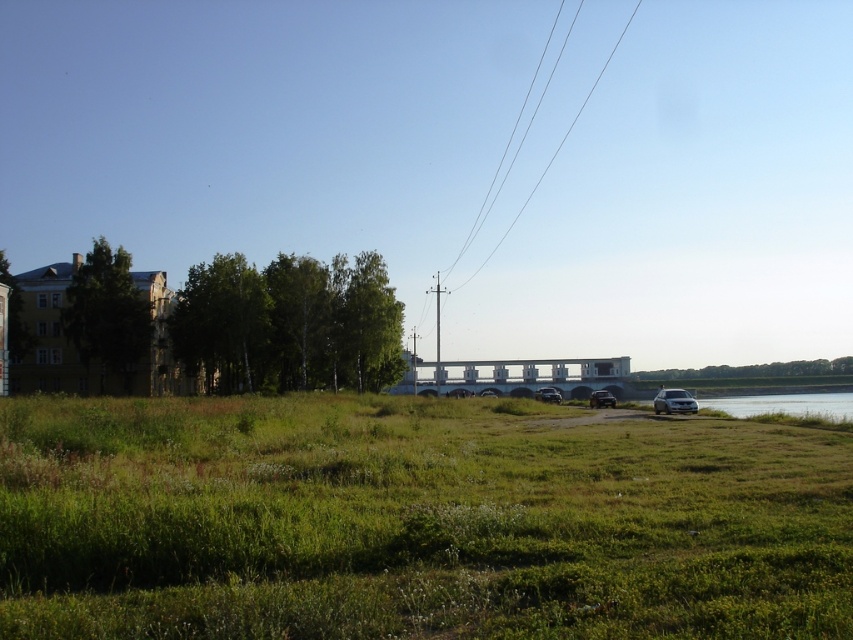
Between white concrete bridge at center and satin silver suv at lower right, which one has more height?

white concrete bridge at center is taller.

Who is more forward, (479, 364) or (653, 404)?

Point (653, 404) is more forward.

Identify the location of white concrete bridge at center. The width and height of the screenshot is (853, 640). (515, 376).

Is green grassy field at lower center further to the viewer compared to white concrete bridge at center?

No.

This screenshot has height=640, width=853. I want to click on green grassy field at lower center, so click(415, 522).

This screenshot has width=853, height=640. In order to click on green grassy field at lower center in this screenshot , I will do `click(415, 522)`.

I want to click on green grassy field at lower center, so click(x=415, y=522).

Does white concrete bridge at center appear on the right side of clear wire at upper center?

In fact, white concrete bridge at center is to the left of clear wire at upper center.

Does white concrete bridge at center appear under clear wire at upper center?

Yes.

Between point (595, 387) and point (547, 161), which one is positioned in front?

Point (595, 387) is more forward.

The height and width of the screenshot is (640, 853). I want to click on white concrete bridge at center, so click(515, 376).